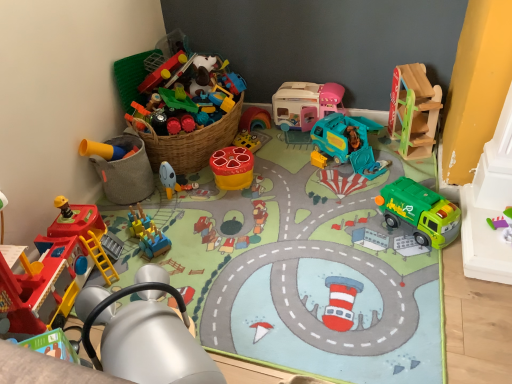
What are the coordinates of `vacant area that lies between green plastic garbage truck at lower right, which is the 8th toy in left-to-right order, and blue plastic train at center, acting as the 8th toy starting from the right` in the screenshot? It's located at (286, 231).